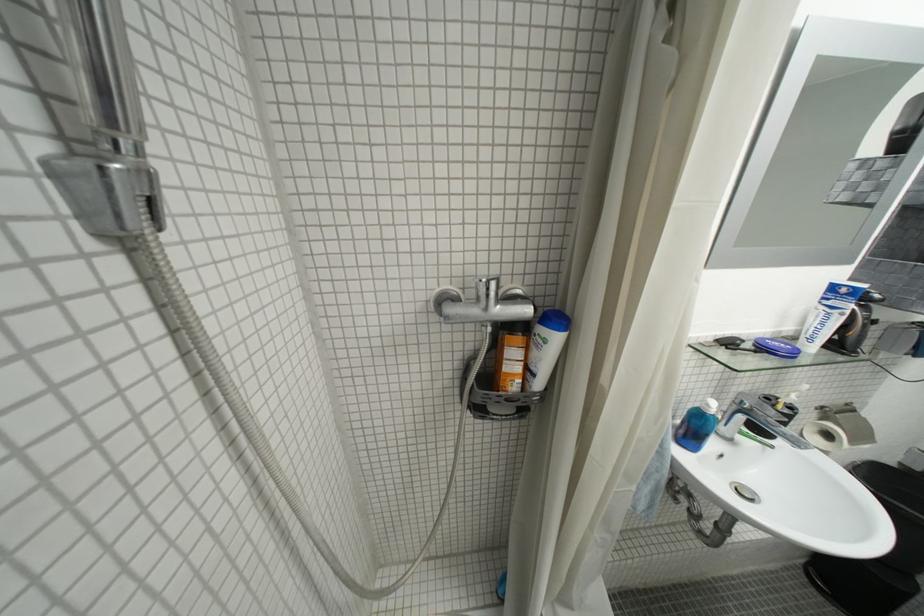
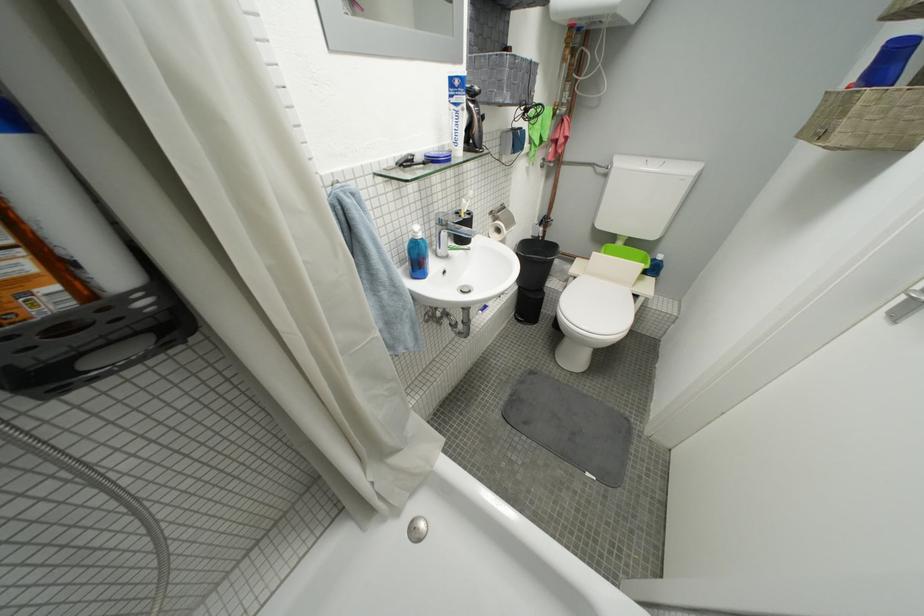
Where in the second image is the point corresponding to [820,342] from the first image?

(465, 145)